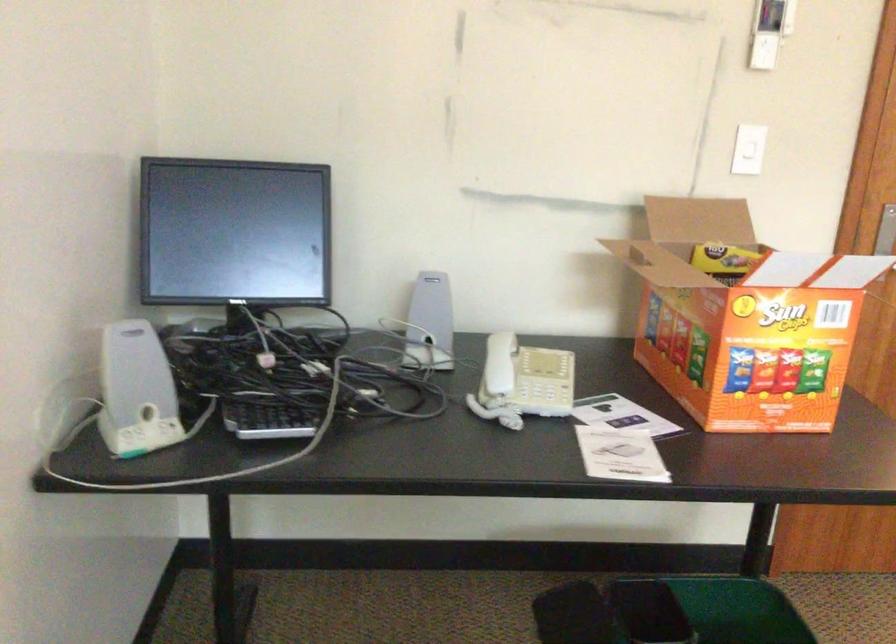
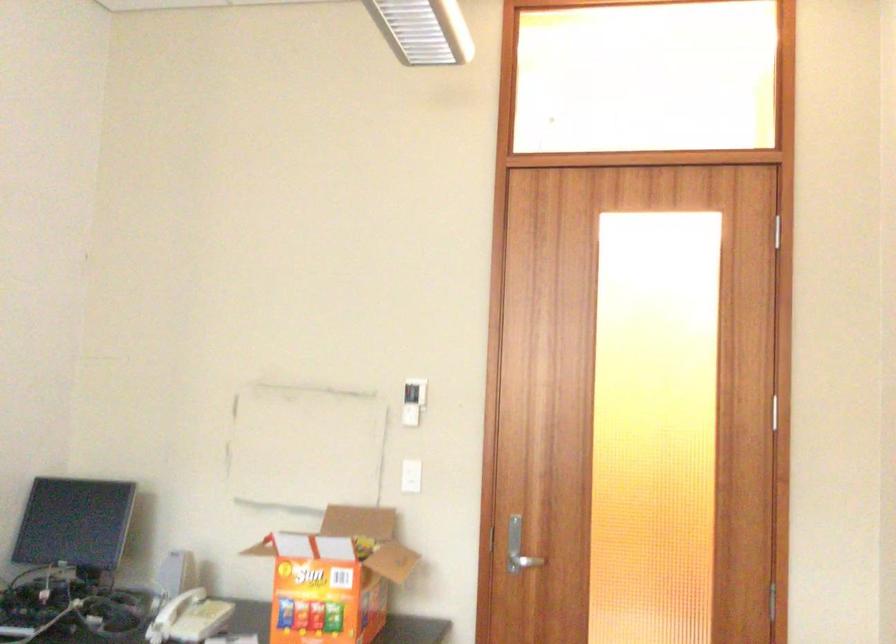
The point at (x=814, y=312) is marked in the first image. Where is the corresponding point in the second image?

(334, 576)